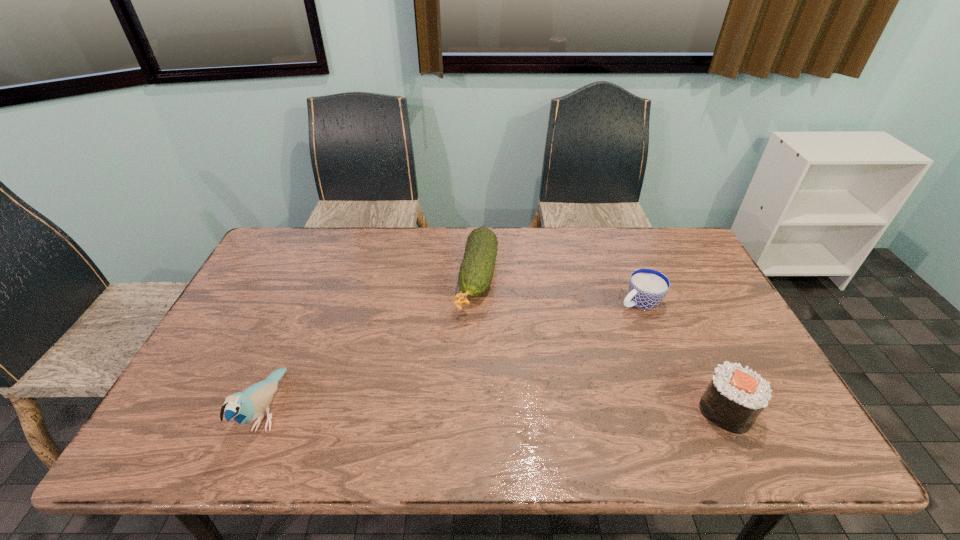
Find the location of a particular element. free area in between the cucumber and the sushi is located at coordinates (602, 344).

At what (x,y) coordinates should I click in order to perform the action: click on free area in between the third object from right to left and the sushi. Please return your answer as a coordinate pair (x, y). Image resolution: width=960 pixels, height=540 pixels. Looking at the image, I should click on (602, 344).

You are a GUI agent. You are given a task and a screenshot of the screen. Output one action in this format:
    pyautogui.click(x=<x>, y=<y>)
    Task: Click on the object that is the second closest one to the tallest object
    The width and height of the screenshot is (960, 540).
    Given the screenshot: What is the action you would take?
    pyautogui.click(x=647, y=288)

At what (x,y) coordinates should I click in order to perform the action: click on object that stands as the second closest to the sushi. Please return your answer as a coordinate pair (x, y). Image resolution: width=960 pixels, height=540 pixels. Looking at the image, I should click on (477, 268).

You are a GUI agent. You are given a task and a screenshot of the screen. Output one action in this format:
    pyautogui.click(x=<x>, y=<y>)
    Task: Click on the vacant space that satisfies the following two spatial constraints: 1. on the front side of the shortest object; 2. on the left side of the third object from right to left
    The height and width of the screenshot is (540, 960).
    Given the screenshot: What is the action you would take?
    pyautogui.click(x=477, y=302)